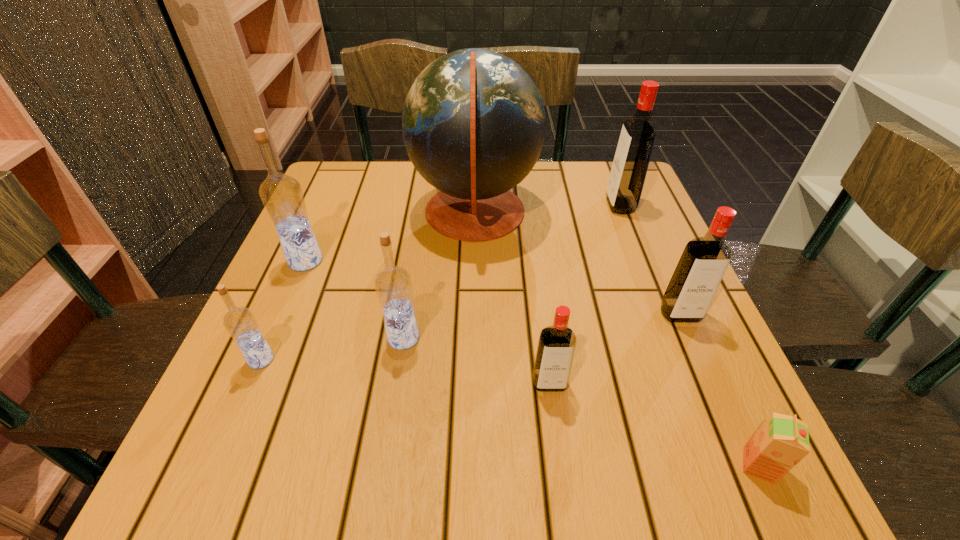
Locate an element on the screen. empty space between the farthest red vodka and the nearest object is located at coordinates (689, 335).

I want to click on free spot between the second farthest vodka and the orange juice, so click(532, 363).

Where is `empty space that is in between the leftmost red vodka and the shortest object`? The width and height of the screenshot is (960, 540). empty space that is in between the leftmost red vodka and the shortest object is located at coordinates (654, 424).

What are the coordinates of `free space between the smallest blue vodka and the biggest blue vodka` in the screenshot? It's located at (283, 310).

Locate an element on the screen. Image resolution: width=960 pixels, height=540 pixels. vacant region between the leftmost red vodka and the farthest vodka is located at coordinates (585, 294).

This screenshot has height=540, width=960. Identify the location of vacant space that is in between the fourth vodka from right to left and the fourth nearest vodka. (541, 326).

This screenshot has height=540, width=960. Identify the location of object that is the fourth closest to the third vodka from left to right. (282, 196).

Where is `object that is the second closest one to the tallest object`? object that is the second closest one to the tallest object is located at coordinates (630, 164).

Choose which vodka is the second nearest neighbor to the rightmost blue vodka. Please provide its 2D coordinates. Your answer should be formatted as a tuple, i.e. [(x, y)], where the tuple contains the x and y coordinates of a point satisfying the conditions above.

[(556, 346)]

Locate an element on the screen. vodka that is the third closest one to the smallest blue vodka is located at coordinates (556, 346).